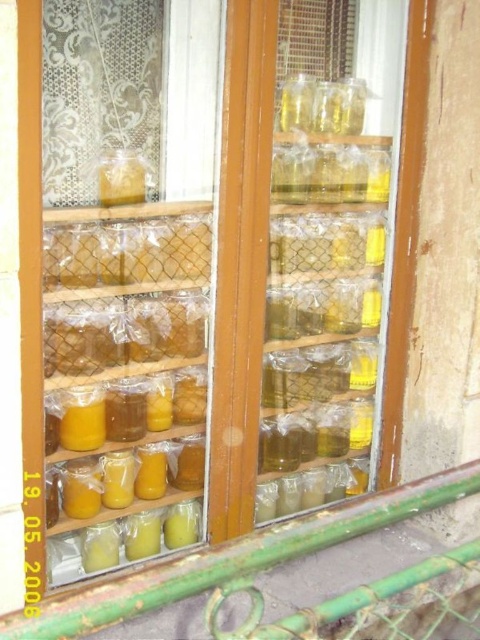
Question: Which point appears farthest from the camera in this image?

Choices:
 (A) (273, 536)
 (B) (103, 260)

Answer: (B)

Question: Is green metal rail at lower center smaller than translucent plastic jar at center?

Choices:
 (A) yes
 (B) no

Answer: (B)

Question: Can you confirm if green metal rail at lower center is thinner than translucent plastic jar at center?

Choices:
 (A) no
 (B) yes

Answer: (A)

Question: Does green metal rail at lower center appear on the left side of translucent plastic jar at center?

Choices:
 (A) no
 (B) yes

Answer: (A)